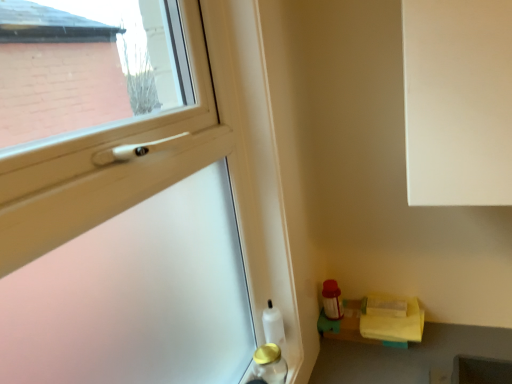
Question: Does gold metallic bottle at lower left, which appears as the first bottle when viewed from the front, have a greater width compared to yellow fabric at lower right?

Choices:
 (A) yes
 (B) no

Answer: (B)

Question: Is gold metallic bottle at lower left, which appears as the first bottle when viewed from the front, looking in the opposite direction of yellow fabric at lower right?

Choices:
 (A) no
 (B) yes

Answer: (A)

Question: Is gold metallic bottle at lower left, which appears as the first bottle when viewed from the front, bigger than yellow fabric at lower right?

Choices:
 (A) yes
 (B) no

Answer: (B)

Question: Is gold metallic bottle at lower left, which appears as the 2th bottle when viewed from the back, taller than yellow fabric at lower right?

Choices:
 (A) yes
 (B) no

Answer: (A)

Question: Considering the relative sizes of gold metallic bottle at lower left, which appears as the 2th bottle when viewed from the back, and yellow fabric at lower right in the image provided, is gold metallic bottle at lower left, which appears as the 2th bottle when viewed from the back, smaller than yellow fabric at lower right?

Choices:
 (A) no
 (B) yes

Answer: (B)

Question: In terms of width, does yellow fabric at lower right look wider or thinner when compared to transparent plastic screen door at lower right?

Choices:
 (A) thin
 (B) wide

Answer: (B)

Question: Considering the positions of point (420, 317) and point (97, 274), is point (420, 317) closer or farther from the camera than point (97, 274)?

Choices:
 (A) farther
 (B) closer

Answer: (A)

Question: Choose the correct answer: Is yellow fabric at lower right inside transparent plastic screen door at lower right or outside it?

Choices:
 (A) inside
 (B) outside

Answer: (B)

Question: Is yellow fabric at lower right bigger or smaller than transparent plastic screen door at lower right?

Choices:
 (A) small
 (B) big

Answer: (A)

Question: From a real-world perspective, is white glossy bottle at lower left, the 1th bottle viewed from the back, above or below yellow fabric at lower right?

Choices:
 (A) below
 (B) above

Answer: (B)

Question: From the image's perspective, is white glossy bottle at lower left, positioned as the second bottle in front-to-back order, located above or below yellow fabric at lower right?

Choices:
 (A) above
 (B) below

Answer: (A)

Question: Is white glossy bottle at lower left, the 1th bottle viewed from the back, in front of or behind yellow fabric at lower right in the image?

Choices:
 (A) behind
 (B) front

Answer: (B)

Question: In terms of height, does white glossy bottle at lower left, the 1th bottle viewed from the back, look taller or shorter compared to yellow fabric at lower right?

Choices:
 (A) short
 (B) tall

Answer: (B)

Question: Considering their positions, is yellow fabric at lower right located in front of or behind white glossy bottle at lower left, positioned as the second bottle in front-to-back order?

Choices:
 (A) behind
 (B) front

Answer: (A)

Question: Considering the positions of point (388, 317) and point (274, 337), is point (388, 317) closer or farther from the camera than point (274, 337)?

Choices:
 (A) closer
 (B) farther

Answer: (B)